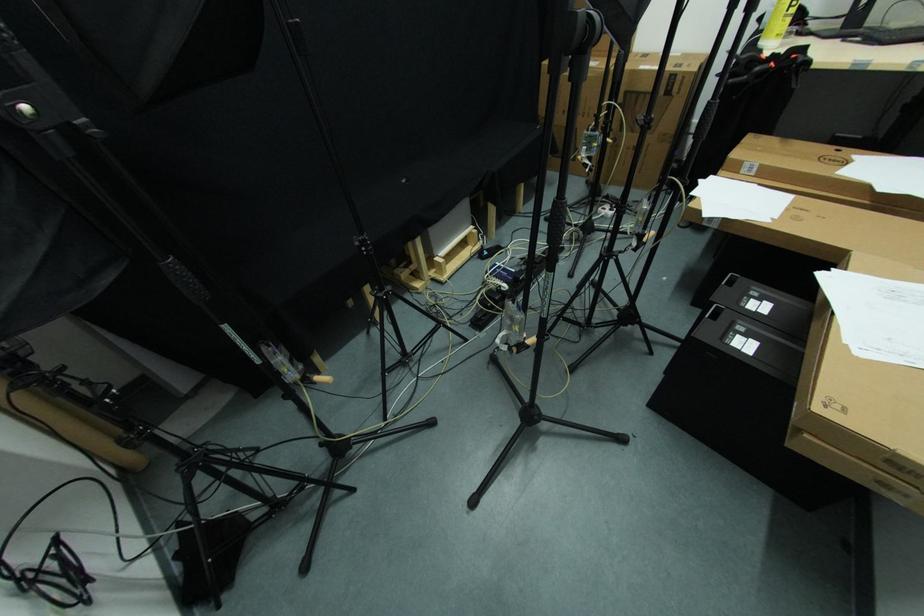
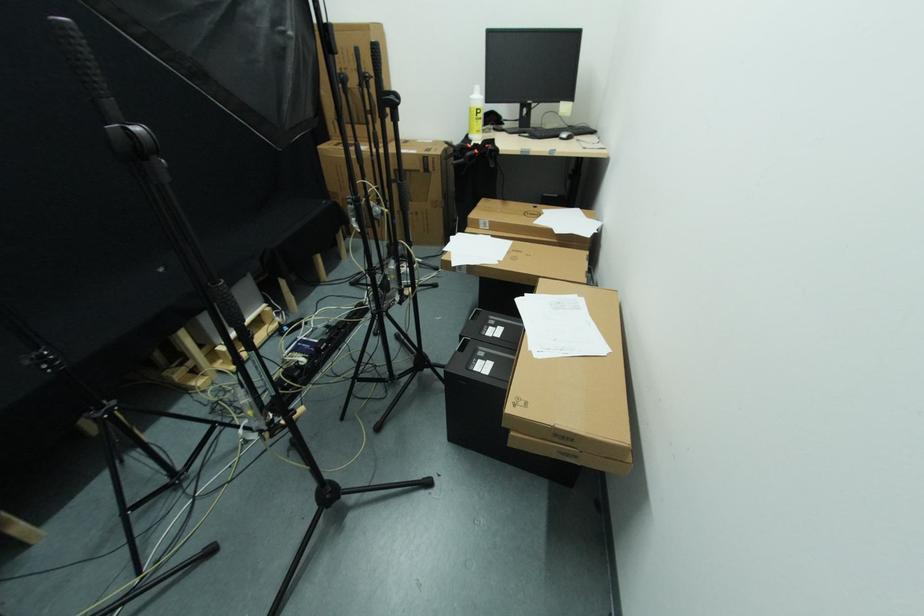
Locate, in the second image, the point that corresponds to [679,81] in the first image.

(432, 161)